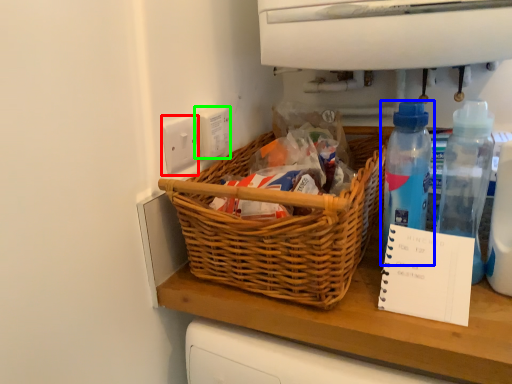
Question: Considering the real-world distances, which object is farthest from electric outlet (highlighted by a red box)? bottle (highlighted by a blue box) or electric outlet (highlighted by a green box)?

Choices:
 (A) bottle
 (B) electric outlet

Answer: (A)